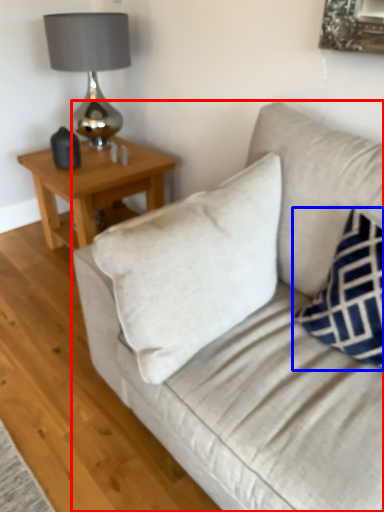
Question: Which of the following is the closest to the observer, studio couch (highlighted by a red box) or pillow (highlighted by a blue box)?

Choices:
 (A) studio couch
 (B) pillow

Answer: (A)